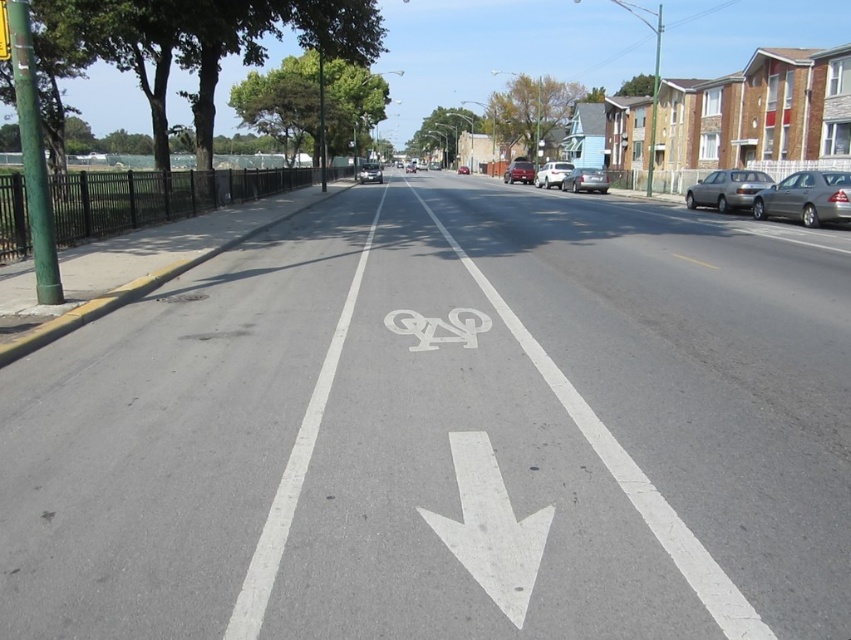
Can you confirm if white painted arrow at center is smaller than white painted line at center?

Yes, white painted arrow at center is smaller than white painted line at center.

Who is more forward, [455,444] or [340,353]?

Point [455,444] is more forward.

What are the coordinates of `white painted arrow at center` in the screenshot? It's located at (490, 528).

Is white asphalt bike lane at center to the left of white painted arrow at center from the viewer's perspective?

Incorrect, white asphalt bike lane at center is not on the left side of white painted arrow at center.

Who is taller, white asphalt bike lane at center or white painted arrow at center?

white asphalt bike lane at center is taller.

Describe the element at coordinates (446, 433) in the screenshot. I see `white asphalt bike lane at center` at that location.

I want to click on white asphalt bike lane at center, so click(446, 433).

Does white painted line at center appear on the left side of satin black car at center?

In fact, white painted line at center is to the right of satin black car at center.

Based on the photo, between white painted line at center and satin black car at center, which one appears on the right side from the viewer's perspective?

Positioned to the right is white painted line at center.

Image resolution: width=851 pixels, height=640 pixels. Find the location of `white painted line at center`. white painted line at center is located at coordinates (293, 472).